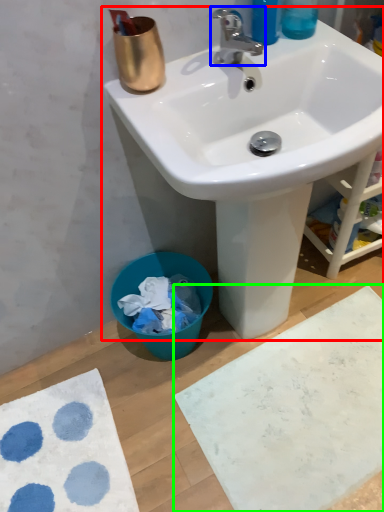
Question: Estimate the real-world distances between objects in this image. Which object is farther from sink (highlighted by a red box), tap (highlighted by a blue box) or bath mat (highlighted by a green box)?

Choices:
 (A) tap
 (B) bath mat

Answer: (B)